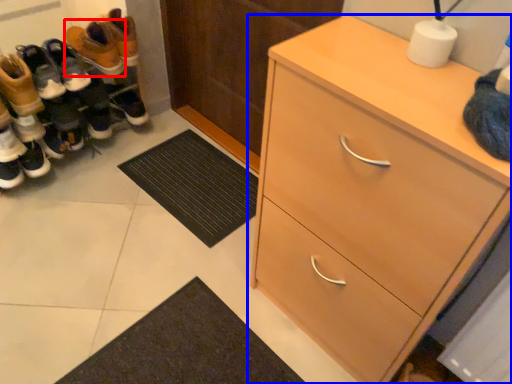
Question: Which object is closer to the camera taking this photo, footwear (highlighted by a red box) or chest of drawers (highlighted by a blue box)?

Choices:
 (A) footwear
 (B) chest of drawers

Answer: (B)